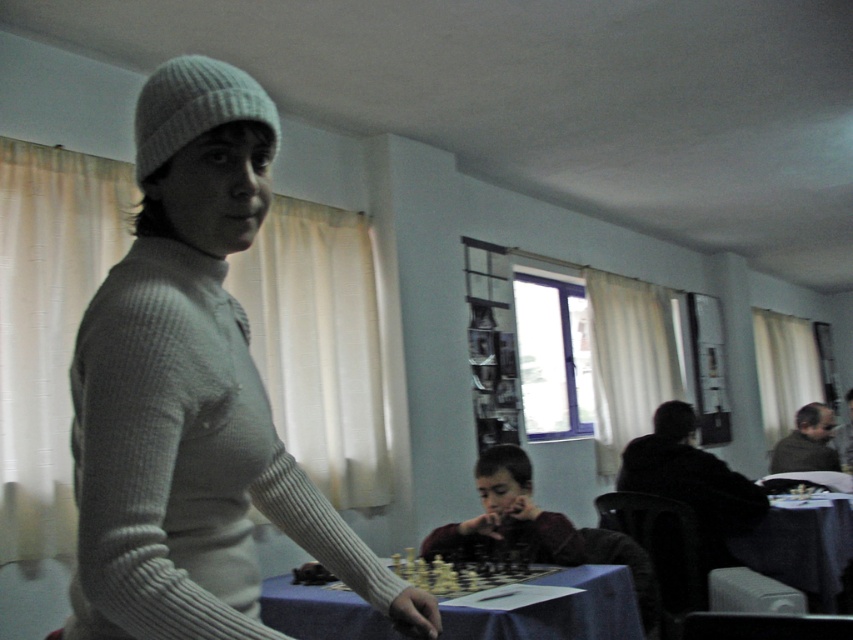
You are a photographer trying to capture a photo of both the white ribbed sweater at center and the dark red sweater at center in the same frame. Based on their positions, which sweater should you focus on first to ensure both are in the frame?

The white ribbed sweater at center is positioned on the left side of dark red sweater at center, so you should focus on the white ribbed sweater at center first to ensure both are in the frame.

You are a photographer setting up for a chess tournament. You need to position a camera to capture both the blue fabric table at center and the dark blue fabric table at lower right. Based on their positions, which table should be placed closer to the camera to ensure both are in frame without moving the camera?

The blue fabric table at center is above the dark blue fabric table at lower right, so to capture both in frame without moving the camera, the dark blue fabric table at lower right should be placed closer to the camera.

You are standing in the room and see the point at coordinates (558,611). Which object is this point located on?

The point at coordinates (558,611) is located on the blue fabric table at center.